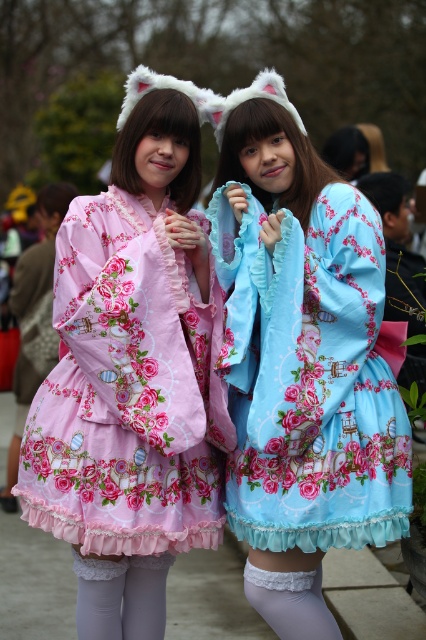
Is blue satin dress at center to the left of pink floral fabric dress at center from the viewer's perspective?

No, blue satin dress at center is not to the left of pink floral fabric dress at center.

Can you confirm if blue satin dress at center is thinner than pink floral fabric dress at center?

Correct, blue satin dress at center's width is less than pink floral fabric dress at center's.

Image resolution: width=426 pixels, height=640 pixels. Identify the location of blue satin dress at center. (302, 360).

Where is `blue satin dress at center`? blue satin dress at center is located at coordinates (302, 360).

Is light gray tights at lower center taller than white lace tights at lower center?

Yes, light gray tights at lower center is taller than white lace tights at lower center.

Between point (77, 628) and point (336, 634), which one is positioned behind?

The point (77, 628) is behind.

Between point (100, 634) and point (336, 625), which one is positioned behind?

The point (336, 625) is more distant.

Where is `light gray tights at lower center`? light gray tights at lower center is located at coordinates (120, 596).

Is blue satin dress at center to the right of light gray tights at lower center from the viewer's perspective?

Correct, you'll find blue satin dress at center to the right of light gray tights at lower center.

In the scene shown: Is blue satin dress at center wider than light gray tights at lower center?

Indeed, blue satin dress at center has a greater width compared to light gray tights at lower center.

Looking at this image, measure the distance between point (x=233, y=336) and camera.

Point (x=233, y=336) is 4.01 meters from camera.

Find the location of a particular element. Image resolution: width=426 pixels, height=640 pixels. blue satin dress at center is located at coordinates (302, 360).